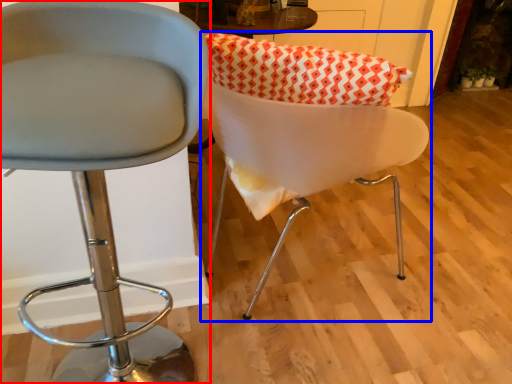
Question: Which point is further to the camera, chair (highlighted by a red box) or chair (highlighted by a blue box)?

Choices:
 (A) chair
 (B) chair

Answer: (B)